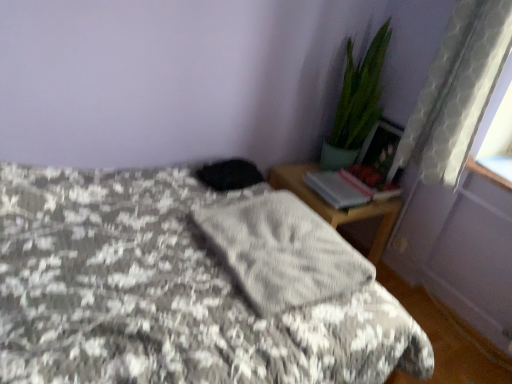
Locate an element on the screen. wooden nightstand at right is located at coordinates (336, 209).

The image size is (512, 384). Describe the element at coordinates (336, 209) in the screenshot. I see `wooden nightstand at right` at that location.

In order to face white sheer curtain at right, should I rotate leftwards or rightwards?

Turn right approximately 28.100 degrees to face it.

The image size is (512, 384). In order to click on green glossy plant at upper right in this screenshot , I will do `click(356, 103)`.

Measure the distance between gray textured blanket at center and camera.

99.12 centimeters.

This screenshot has width=512, height=384. Describe the element at coordinates (229, 174) in the screenshot. I see `black matte pillow at center` at that location.

Locate an element on the screen. The image size is (512, 384). wooden nightstand at right is located at coordinates (336, 209).

Is hardcover book at right positioned with its back to black matte pillow at center?

No.

Considering the positions of objects hardcover book at right and black matte pillow at center in the image provided, who is more to the right, hardcover book at right or black matte pillow at center?

Positioned to the right is hardcover book at right.

Which is closer, (323, 191) or (215, 168)?

The point (215, 168) is closer to the camera.

Considering the relative sizes of hardcover book at right and black matte pillow at center in the image provided, is hardcover book at right wider than black matte pillow at center?

Incorrect, the width of hardcover book at right does not surpass that of black matte pillow at center.

Is white sheer curtain at right behind clear glass window sill at upper right?

No, it is not.

Visually, is white sheer curtain at right positioned to the left or to the right of clear glass window sill at upper right?

white sheer curtain at right is to the left of clear glass window sill at upper right.

Considering the relative sizes of white sheer curtain at right and clear glass window sill at upper right in the image provided, is white sheer curtain at right taller than clear glass window sill at upper right?

Yes, white sheer curtain at right is taller than clear glass window sill at upper right.

Is the surface of white sheer curtain at right in direct contact with clear glass window sill at upper right?

No, white sheer curtain at right is not next to clear glass window sill at upper right.

Considering the relative sizes of green glossy plant at upper right and hardcover book at right in the image provided, is green glossy plant at upper right bigger than hardcover book at right?

Yes, green glossy plant at upper right is bigger than hardcover book at right.

Is green glossy plant at upper right facing away from hardcover book at right?

green glossy plant at upper right does not have its back to hardcover book at right.

From the image's perspective, would you say green glossy plant at upper right is shown under hardcover book at right?

Actually, green glossy plant at upper right appears above hardcover book at right in the image.

From a real-world perspective, is green glossy plant at upper right above or below hardcover book at right?

In terms of real-world spatial position, green glossy plant at upper right is above hardcover book at right.

Is clear glass window sill at upper right not inside gray fabric at center?

Yes, clear glass window sill at upper right is outside of gray fabric at center.

Are clear glass window sill at upper right and gray fabric at center making contact?

No, clear glass window sill at upper right is not next to gray fabric at center.

Is clear glass window sill at upper right positioned behind gray fabric at center?

Yes, clear glass window sill at upper right is behind gray fabric at center.

Which object is positioned more to the left, gray fabric at center or black matte pillow at center?

Positioned to the left is black matte pillow at center.

From a real-world perspective, is gray fabric at center on top of black matte pillow at center?

Incorrect, from a real-world perspective, gray fabric at center is lower than black matte pillow at center.

How distant is gray fabric at center from black matte pillow at center?

They are 42.16 centimeters apart.

Considering the relative sizes of gray fabric at center and black matte pillow at center in the image provided, is gray fabric at center wider than black matte pillow at center?

Indeed, gray fabric at center has a greater width compared to black matte pillow at center.

Is clear glass window sill at upper right far away from gray textured blanket at center?

clear glass window sill at upper right is positioned a significant distance from gray textured blanket at center.

Locate an element on the screen. The height and width of the screenshot is (384, 512). bed on the left side of clear glass window sill at upper right is located at coordinates (164, 294).

From a real-world perspective, is clear glass window sill at upper right physically above gray textured blanket at center?

Correct, in the physical world, clear glass window sill at upper right is higher than gray textured blanket at center.

Who is taller, clear glass window sill at upper right or gray textured blanket at center?

gray textured blanket at center is taller.

How many degrees apart are the facing directions of black matte pillow at center and clear glass window sill at upper right?

black matte pillow at center and clear glass window sill at upper right are facing 167 degrees away from each other.

From the picture: Can you confirm if black matte pillow at center is shorter than clear glass window sill at upper right?

Incorrect, the height of black matte pillow at center does not fall short of that of clear glass window sill at upper right.

Do you think black matte pillow at center is within clear glass window sill at upper right, or outside of it?

black matte pillow at center exists outside the volume of clear glass window sill at upper right.

Can you confirm if black matte pillow at center is wider than clear glass window sill at upper right?

Indeed, black matte pillow at center has a greater width compared to clear glass window sill at upper right.

Identify the location of book below the black matte pillow at center (from a real-world perspective). The width and height of the screenshot is (512, 384). (345, 189).

Find the location of a particular element. The height and width of the screenshot is (384, 512). curtain that appears in front of the clear glass window sill at upper right is located at coordinates (457, 90).

Looking at the image, which one is located further to wooden nightstand at right, hardcover book at right or clear glass window sill at upper right?

Among the two, clear glass window sill at upper right is located further to wooden nightstand at right.

Looking at the image, which one is located further to black matte pillow at center, hardcover book at right or white sheer curtain at right?

The object further to black matte pillow at center is white sheer curtain at right.

Which object lies further to the anchor point black matte pillow at center, wooden nightstand at right or hardcover book at right?

hardcover book at right is positioned further to the anchor black matte pillow at center.

When comparing their distances from black matte pillow at center, does white sheer curtain at right or wooden nightstand at right seem further?

white sheer curtain at right is further to black matte pillow at center.

From the image, which object appears to be nearer to gray fabric at center, clear glass window sill at upper right or black matte pillow at center?

black matte pillow at center is closer to gray fabric at center.

Looking at the image, which one is located further to black matte pillow at center, gray fabric at center or white sheer curtain at right?

The object further to black matte pillow at center is white sheer curtain at right.

Which object lies further to the anchor point clear glass window sill at upper right, white sheer curtain at right or black matte pillow at center?

black matte pillow at center is further to clear glass window sill at upper right.

Based on their spatial positions, is gray textured blanket at center or green glossy plant at upper right further from white sheer curtain at right?

gray textured blanket at center lies further to white sheer curtain at right than the other object.

Locate an element on the screen. This screenshot has width=512, height=384. nightstand between black matte pillow at center and green glossy plant at upper right from left to right is located at coordinates (336, 209).

The width and height of the screenshot is (512, 384). What are the coordinates of `houseplant between white sheer curtain at right and wooden nightstand at right along the z-axis` in the screenshot? It's located at (356, 103).

I want to click on nightstand between white sheer curtain at right and hardcover book at right along the z-axis, so click(336, 209).

Locate an element on the screen. The width and height of the screenshot is (512, 384). window sill positioned between gray textured blanket at center and green glossy plant at upper right from near to far is located at coordinates (487, 174).